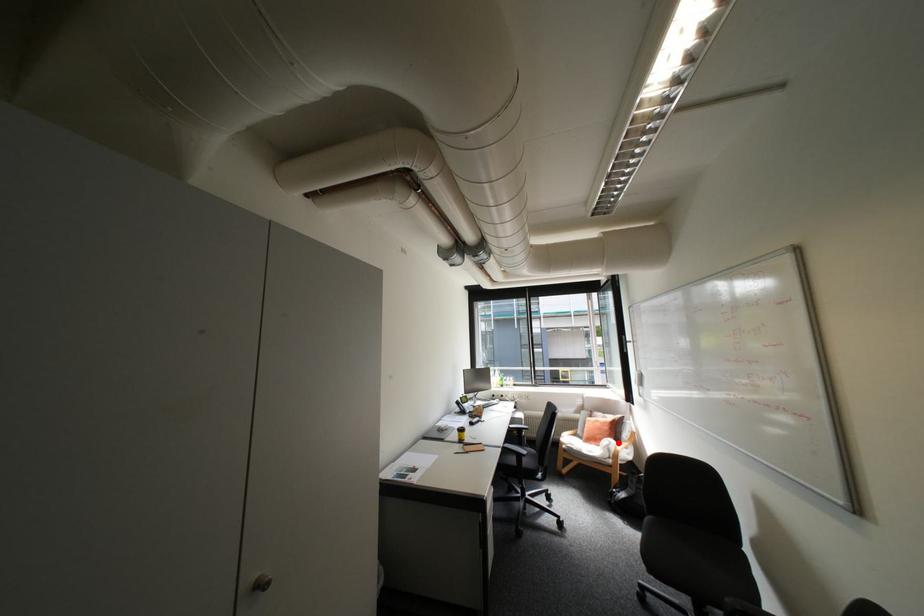
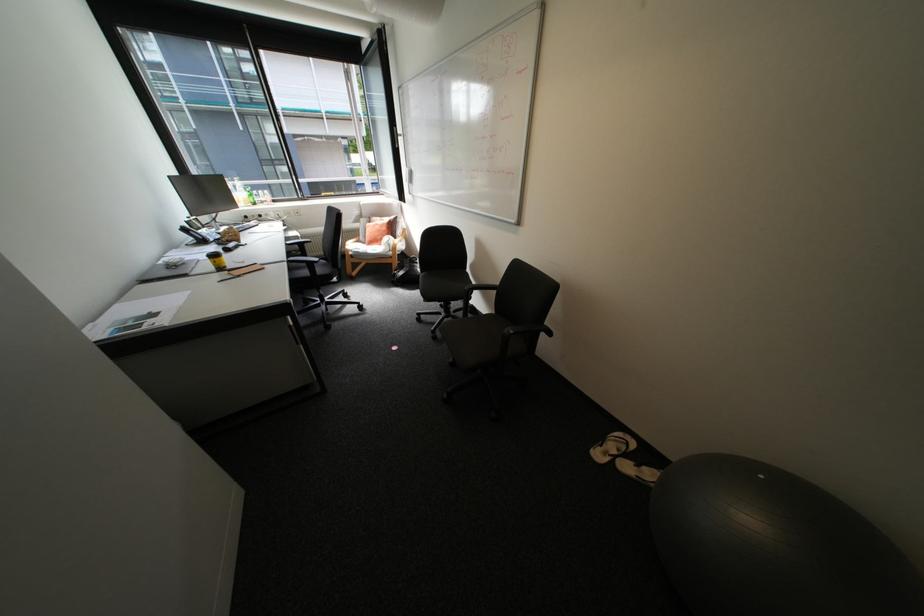
Question: I am providing you with two images of the same scene from different viewpoints. Given a red point in image1, look at the same physical point in image2. Is it:

Choices:
 (A) Closer to the viewpoint
 (B) Farther from the viewpoint

Answer: (A)